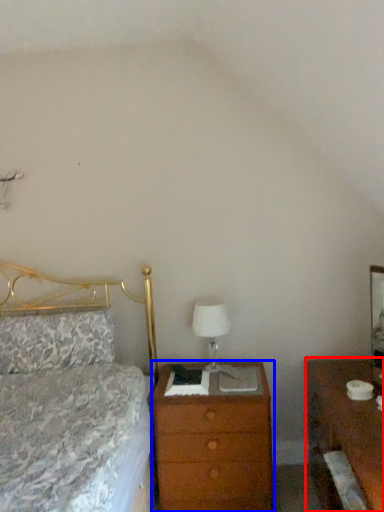
Question: Which of the following is the closest to the observer, nightstand (highlighted by a red box) or chest of drawers (highlighted by a blue box)?

Choices:
 (A) nightstand
 (B) chest of drawers

Answer: (A)